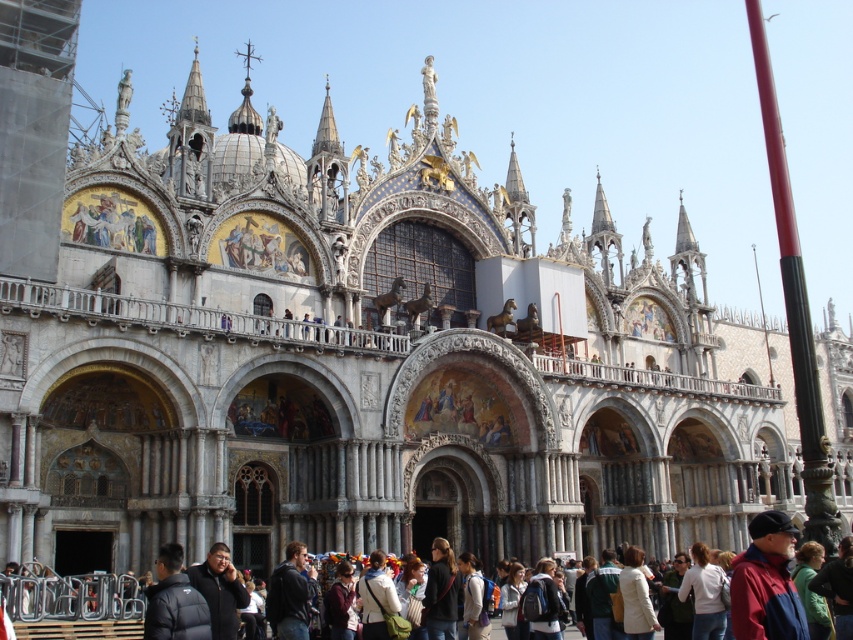
You are a tourist standing in front of St. Mark Basilica and you see the dark gray hoodie at center and the white matte jacket at lower center. Which clothing item is closer to the ground?

The dark gray hoodie at center is positioned under the white matte jacket at lower center, so the dark gray hoodie at center is closer to the ground.

You are a tourist visiting St. Mark Basilica. You see the dark gray hoodie at center and the white matte jacket at lower center. Which clothing item is closer to you?

The dark gray hoodie at center is closer to you since it is in front of the white matte jacket at lower center.

You are a photographer standing in front of St. Mark Basilica. You notice a white cotton shirt at lower right and a white matte jacket at lower center in your viewfinder. Which clothing item appears wider in your current view?

The white cotton shirt at lower right appears wider than the white matte jacket at lower center because its width surpasses the jacket.